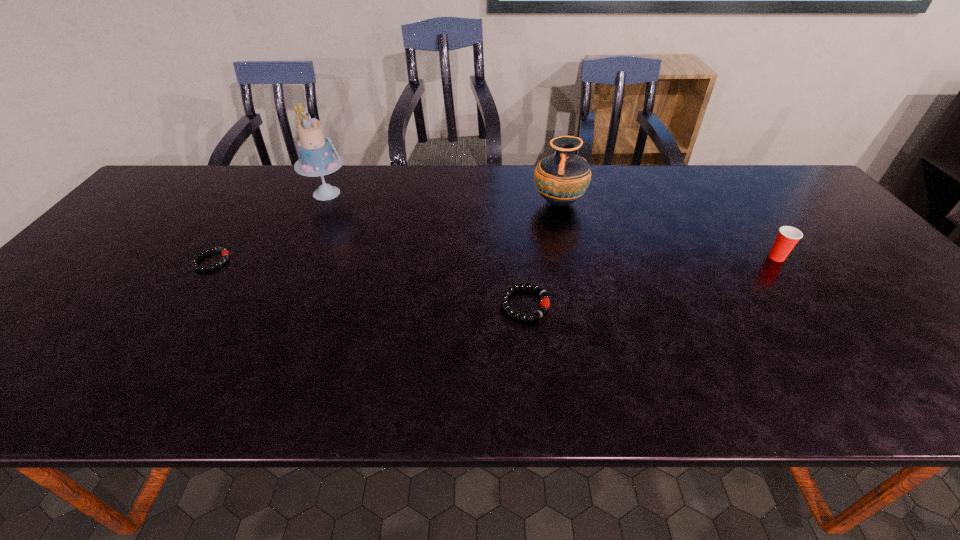
Image resolution: width=960 pixels, height=540 pixels. What are the coordinates of `free space between the shortest object and the second tallest object` in the screenshot? It's located at (385, 232).

Select which object appears as the fourth closest to the Dixie cup. Please provide its 2D coordinates. Your answer should be formatted as a tuple, i.e. [(x, y)], where the tuple contains the x and y coordinates of a point satisfying the conditions above.

[(225, 253)]

Where is `the closest object to the tallest object`? The image size is (960, 540). the closest object to the tallest object is located at coordinates (225, 253).

Where is `blank area in the image that satisfies the following two spatial constraints: 1. on the front side of the farther bracelet; 2. on the left side of the fourth tallest object`? The height and width of the screenshot is (540, 960). blank area in the image that satisfies the following two spatial constraints: 1. on the front side of the farther bracelet; 2. on the left side of the fourth tallest object is located at coordinates (182, 304).

Where is `vacant area in the image that satisfies the following two spatial constraints: 1. with a ladder on the side of the pottery; 2. on the right side of the cake`? vacant area in the image that satisfies the following two spatial constraints: 1. with a ladder on the side of the pottery; 2. on the right side of the cake is located at coordinates (322, 203).

Find the location of `free space that satisfies the following two spatial constraints: 1. with a ladder on the side of the nearest object; 2. on the right side of the fourth object from right to left`. free space that satisfies the following two spatial constraints: 1. with a ladder on the side of the nearest object; 2. on the right side of the fourth object from right to left is located at coordinates (275, 304).

At what (x,y) coordinates should I click in order to perform the action: click on free space in the image that satisfies the following two spatial constraints: 1. on the back side of the shortest object; 2. on the left side of the pottery. Please return your answer as a coordinate pair (x, y). Looking at the image, I should click on (251, 203).

What are the coordinates of `vacant space that satisfies the following two spatial constraints: 1. on the back side of the pottery; 2. on the left side of the right bracelet` in the screenshot? It's located at (515, 203).

The height and width of the screenshot is (540, 960). What are the coordinates of `free space that satisfies the following two spatial constraints: 1. on the front side of the third shortest object; 2. on the right side of the pottery` in the screenshot? It's located at (571, 258).